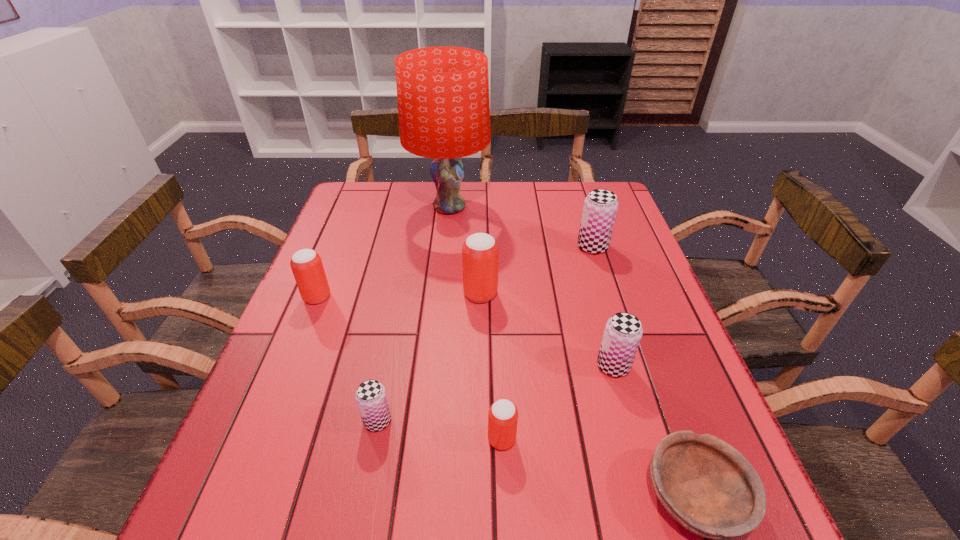
Find the location of `object present at the left edge`. object present at the left edge is located at coordinates (306, 264).

Where is `free region at the far edge of the desktop`? free region at the far edge of the desktop is located at coordinates (428, 197).

Locate an element on the screen. This screenshot has height=540, width=960. vacant space at the near edge of the desktop is located at coordinates (437, 497).

The height and width of the screenshot is (540, 960). In the image, there is a desktop. Find the location of `vacant space at the left edge`. vacant space at the left edge is located at coordinates (249, 475).

In the image, there is a desktop. Identify the location of vacant space at the right edge. This screenshot has height=540, width=960. (653, 319).

The image size is (960, 540). In the image, there is a desktop. What are the coordinates of `free space at the far left corner` in the screenshot? It's located at (372, 187).

What are the coordinates of `vacant region at the far right corner of the desktop` in the screenshot? It's located at (628, 219).

At what (x,y) coordinates should I click in order to perform the action: click on vacant space that's between the second biggest purple beer can and the tallest object. Please return your answer as a coordinate pair (x, y). This screenshot has height=540, width=960. Looking at the image, I should click on click(x=531, y=287).

Where is `free space between the second nearest purple beer can and the smallest red beer can`? free space between the second nearest purple beer can and the smallest red beer can is located at coordinates (558, 402).

The height and width of the screenshot is (540, 960). I want to click on free space that is in between the seventh nearest object and the leftmost beer can, so click(x=455, y=272).